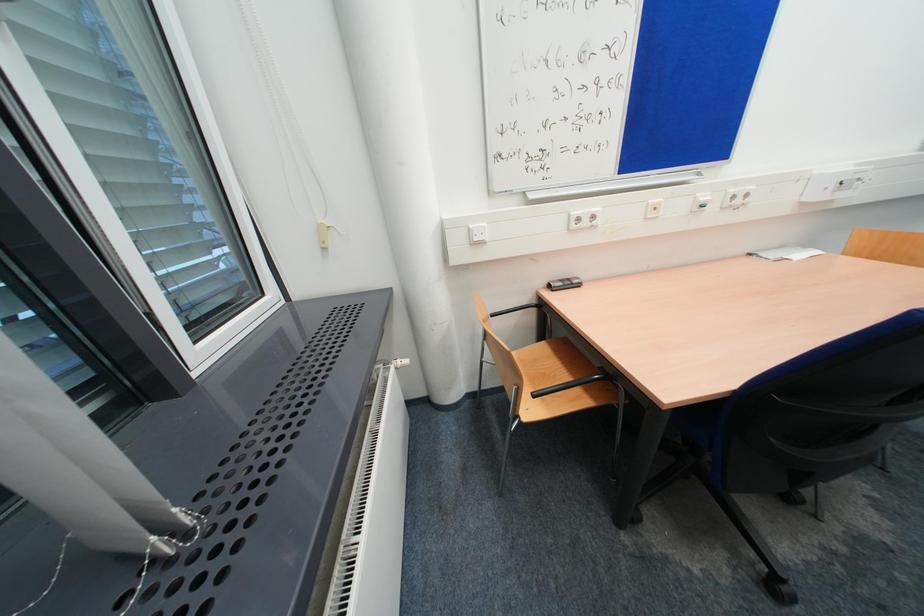
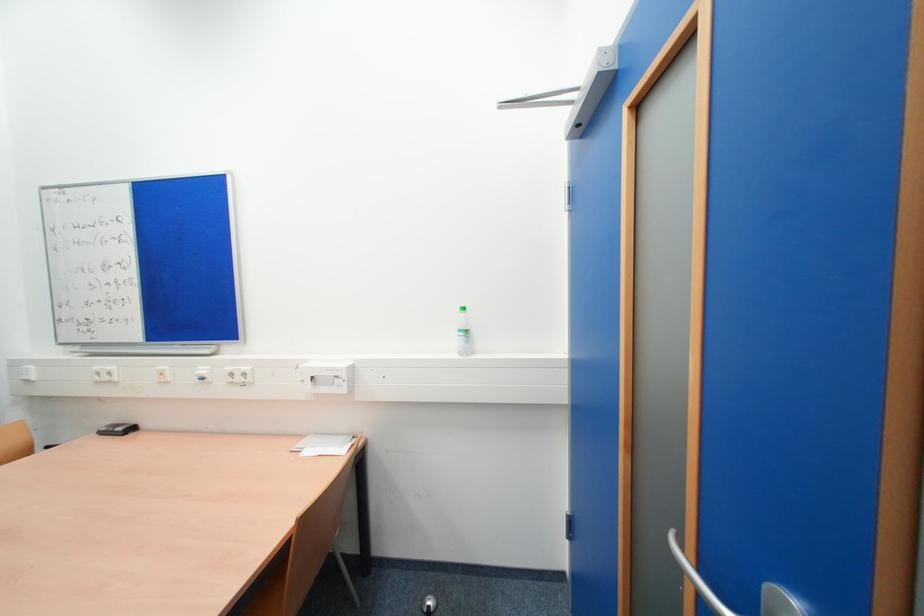
Question: The images are taken continuously from a first-person perspective. In which direction are you moving?

Choices:
 (A) Left
 (B) Right
 (C) Forward
 (D) Backward

Answer: (B)